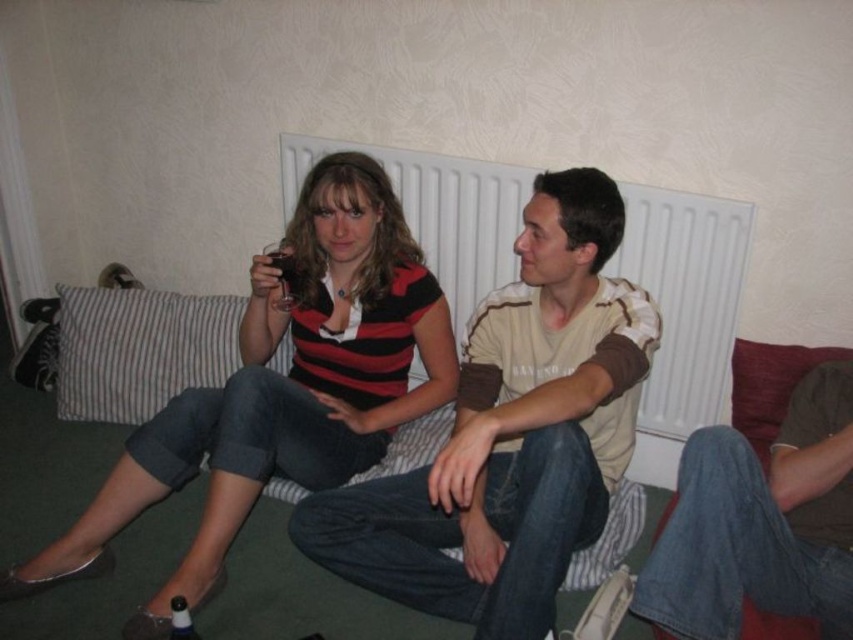
Question: Where is matte striped shirt at center located in relation to white textured radiator at center in the image?

Choices:
 (A) below
 (B) above

Answer: (A)

Question: Does white textured radiator at center appear on the right side of jeans at lower right?

Choices:
 (A) no
 (B) yes

Answer: (A)

Question: Does matte striped shirt at center have a lesser width compared to jeans at lower right?

Choices:
 (A) no
 (B) yes

Answer: (A)

Question: Which is nearer to the matte beige t-shirt at center?

Choices:
 (A) jeans at lower right
 (B) matte striped shirt at center

Answer: (A)

Question: Which of the following is the farthest from the observer?

Choices:
 (A) (730, 577)
 (B) (524, 561)
 (C) (651, 276)

Answer: (C)

Question: Which object is the closest to the white textured radiator at center?

Choices:
 (A) matte striped shirt at center
 (B) jeans at lower right
 (C) matte beige t-shirt at center

Answer: (A)